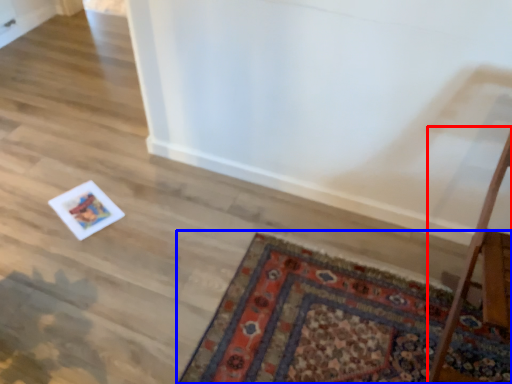
Question: Among these objects, which one is farthest to the camera, table (highlighted by a red box) or mat (highlighted by a blue box)?

Choices:
 (A) table
 (B) mat

Answer: (B)